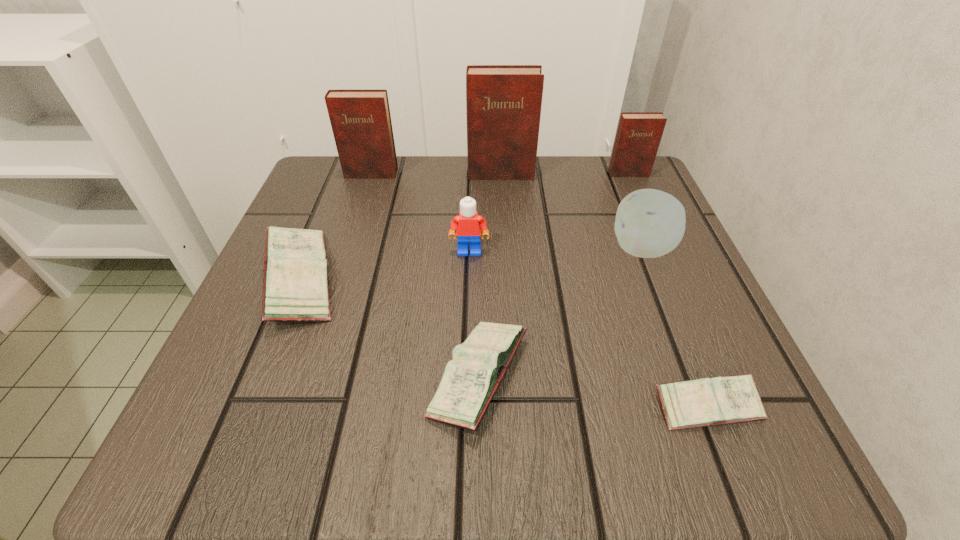
Locate an element on the screen. This screenshot has width=960, height=540. the fifth tallest diary is located at coordinates (469, 382).

Where is `the second pink diary from left to right`? Image resolution: width=960 pixels, height=540 pixels. the second pink diary from left to right is located at coordinates click(x=469, y=382).

The image size is (960, 540). Identify the location of the smallest pink diary. (702, 402).

I want to click on the rightmost pink diary, so click(x=702, y=402).

You are a GUI agent. You are given a task and a screenshot of the screen. Output one action in this format:
    pyautogui.click(x=<x>, y=<y>)
    Task: Click on the blank area located 0.120m on the front cover of the tallest object
    This screenshot has height=540, width=960.
    Given the screenshot: What is the action you would take?
    pyautogui.click(x=503, y=213)

Locate an element on the screen. This screenshot has height=540, width=960. vacant space situated on the front cover of the second smallest reddish-brown diary is located at coordinates (358, 214).

Where is `vacant space located on the front cover of the rightmost reddish-brown diary`? The width and height of the screenshot is (960, 540). vacant space located on the front cover of the rightmost reddish-brown diary is located at coordinates (661, 249).

The image size is (960, 540). What are the coordinates of `free spot located 0.170m on the face of the white Lego` in the screenshot? It's located at (468, 332).

The image size is (960, 540). I want to click on blank space located on the front of the white apple, so click(705, 409).

This screenshot has width=960, height=540. Find the location of `vacant space located on the front of the leftmost pink diary`. vacant space located on the front of the leftmost pink diary is located at coordinates (232, 446).